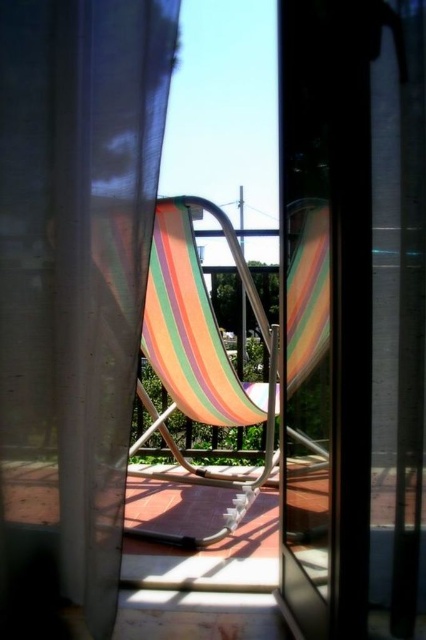
You are standing at the point marked as point [91,460] and want to walk to the lounge chair on the balcony. The distance between you and the lounge chair is 1.22 meters. If your walking speed is 0.5 meters per second, how many seconds will it take you to reach the lounge chair?

The distance between you and the lounge chair is 1.22 meters, and your walking speed is 0.5 meters per second. To calculate the time required, divide the distance by the speed. 1.22 meters divided by 0.5 meters per second equals 2.44 seconds. Therefore, it will take approximately 2.44 seconds to reach the lounge chair.

You are trying to move the multicolored fabric beach chair at center through the translucent plastic screen door at center. Based on their sizes, will the chair fit through the door?

The multicolored fabric beach chair at center is bigger than the translucent plastic screen door at center, so it will not fit through the door.

You are standing inside the room and want to exit to the balcony. You see the sheer white curtain at center and the translucent plastic screen door at center. Which object should you move to first to reach the balcony?

You should move to the translucent plastic screen door at center first because the sheer white curtain at center is to the left of it, meaning the door is closer to the balcony exit.